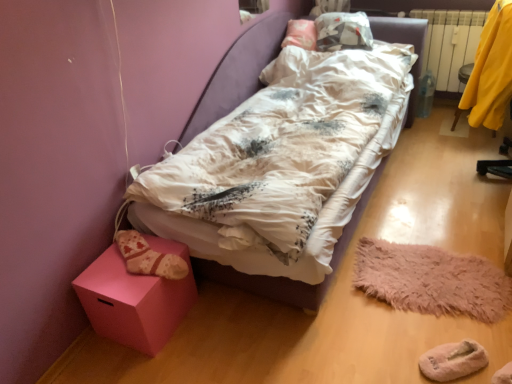
Question: Does pink matte cube at lower left have a lesser width compared to fuzzy pink mat at lower right?

Choices:
 (A) yes
 (B) no

Answer: (A)

Question: Does pink matte cube at lower left lie behind fuzzy pink mat at lower right?

Choices:
 (A) no
 (B) yes

Answer: (A)

Question: From the image's perspective, does pink matte cube at lower left appear higher than fuzzy pink mat at lower right?

Choices:
 (A) yes
 (B) no

Answer: (B)

Question: From the image's perspective, is pink matte cube at lower left under fuzzy pink mat at lower right?

Choices:
 (A) no
 (B) yes

Answer: (B)

Question: Is pink matte cube at lower left facing away from fuzzy pink mat at lower right?

Choices:
 (A) yes
 (B) no

Answer: (B)

Question: Considering the relative positions of pink matte cube at lower left and fuzzy pink mat at lower right in the image provided, is pink matte cube at lower left in front of fuzzy pink mat at lower right?

Choices:
 (A) yes
 (B) no

Answer: (A)

Question: Is white plastic radiator at right at the right side of fuzzy pink mat at lower right?

Choices:
 (A) yes
 (B) no

Answer: (A)

Question: From a real-world perspective, is white plastic radiator at right located higher than fuzzy pink mat at lower right?

Choices:
 (A) yes
 (B) no

Answer: (A)

Question: From the image's perspective, is white plastic radiator at right beneath fuzzy pink mat at lower right?

Choices:
 (A) no
 (B) yes

Answer: (A)

Question: Is white plastic radiator at right bigger than fuzzy pink mat at lower right?

Choices:
 (A) no
 (B) yes

Answer: (B)

Question: Is white plastic radiator at right positioned in front of fuzzy pink mat at lower right?

Choices:
 (A) yes
 (B) no

Answer: (B)

Question: Is fuzzy pink mat at lower right completely or partially inside white plastic radiator at right?

Choices:
 (A) yes
 (B) no

Answer: (B)

Question: From the image's perspective, is yellow fabric at right over fuzzy pink mat at lower right?

Choices:
 (A) no
 (B) yes

Answer: (B)